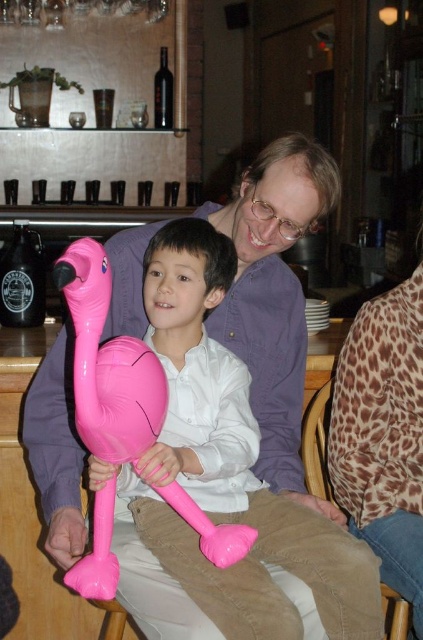
Question: Is leopard print blouse at upper right further to camera compared to pink inflatable flamingo at center?

Choices:
 (A) no
 (B) yes

Answer: (B)

Question: Is matte purple shirt at center wider than leopard print blouse at upper right?

Choices:
 (A) yes
 (B) no

Answer: (A)

Question: Is leopard print blouse at upper right smaller than leopard print fabric at lower right?

Choices:
 (A) yes
 (B) no

Answer: (B)

Question: Which point is closer to the camera?

Choices:
 (A) [123, 378]
 (B) [335, 486]
 (C) [131, 248]
 (D) [326, 499]

Answer: (A)

Question: Which point is closer to the camera?

Choices:
 (A) (142, 246)
 (B) (345, 410)
 (C) (329, 403)
 (D) (117, 438)

Answer: (D)

Question: Among these points, which one is nearest to the camera?

Choices:
 (A) (58, 432)
 (B) (406, 406)
 (C) (302, 416)

Answer: (A)